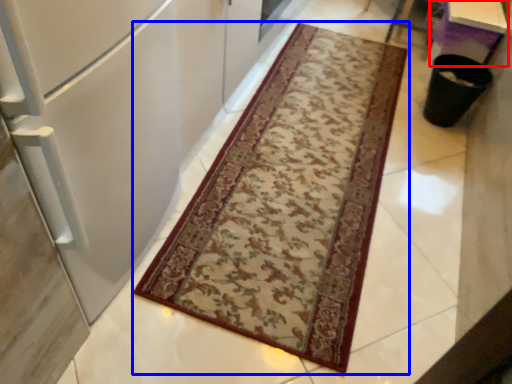
Question: Among these objects, which one is farthest to the camera, table (highlighted by a red box) or mat (highlighted by a blue box)?

Choices:
 (A) table
 (B) mat

Answer: (A)